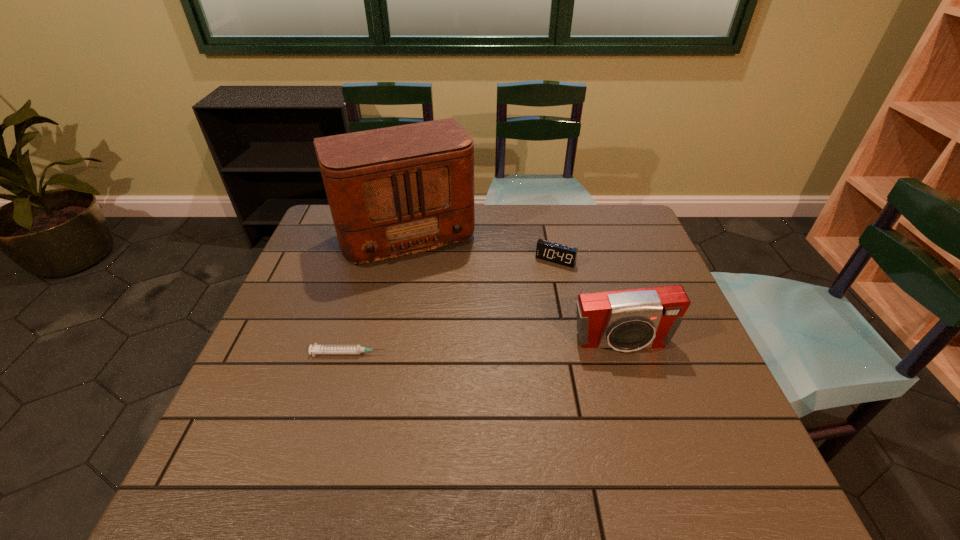
At what (x,y) coordinates should I click in order to perform the action: click on vacant space on the desktop that is between the syringe and the second tallest object and is positioned on the front-facing side of the alarm clock. Please return your answer as a coordinate pair (x, y). The height and width of the screenshot is (540, 960). Looking at the image, I should click on (510, 348).

Where is `free spot on the desktop that is between the shortest object and the second tallest object and is positioned on the front panel of the radio receiver`? free spot on the desktop that is between the shortest object and the second tallest object and is positioned on the front panel of the radio receiver is located at coordinates (452, 349).